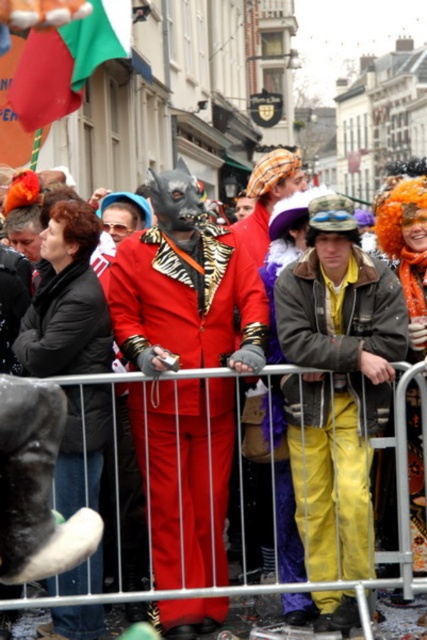
Does point (227, 577) come behind point (354, 228)?

That is True.

Which of these two, shiny red suit at center or yellow matte pants at center, stands shorter?

shiny red suit at center

Describe the element at coordinates (186, 298) in the screenshot. I see `shiny red suit at center` at that location.

This screenshot has height=640, width=427. I want to click on shiny red suit at center, so click(186, 298).

Based on the photo, between yellow matte pants at center and velvet black boot at lower left, which one has more height?

yellow matte pants at center

Which is below, yellow matte pants at center or velvet black boot at lower left?

Positioned lower is velvet black boot at lower left.

Identify the location of yellow matte pants at center. This screenshot has height=640, width=427. (336, 385).

You are a GUI agent. You are given a task and a screenshot of the screen. Output one action in this format:
    pyautogui.click(x=<x>, y=<y>)
    Task: Click on the yellow matte pants at center
    Image resolution: width=427 pixels, height=640 pixels.
    Given the screenshot: What is the action you would take?
    pyautogui.click(x=336, y=385)

Does velvet black boot at lower left have a lesser width compared to metallic silver barrier at center?

Yes.

Is point (26, 321) positioned after point (418, 385)?

Yes, it is behind point (418, 385).

Identify the location of velvet black boot at lower left. (66, 324).